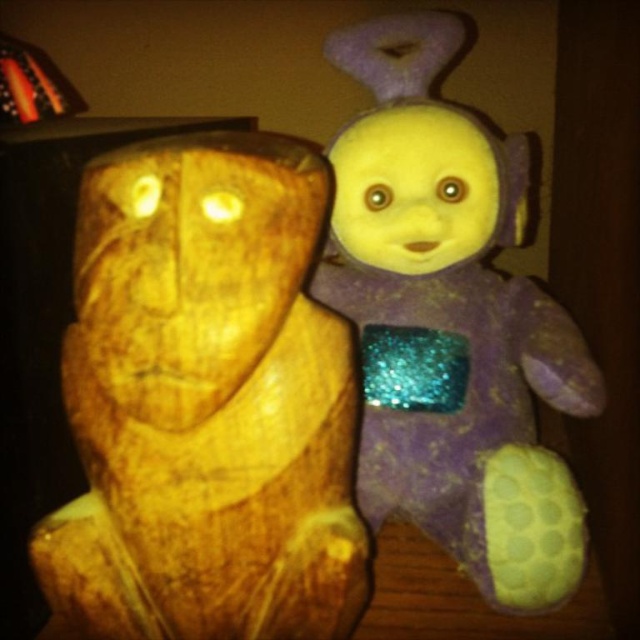
You are an art collector who wants to place a 10 inch wide decorative item between the wooden carving at left and the purple glittery plush at upper right. Based on the spacing between them, will there be enough room for the item?

The wooden carving at left is 8.08 inches from the purple glittery plush at upper right. Since the decorative item is 10 inches wide, which is wider than the available space between them, it will not fit.

You are an interior designer arranging a shelf. You have the wooden carving at left and the purple glittery plush at upper right. If you want to place them so that one is closer to the viewer, which object should you position forward?

You should position the wooden carving at left forward since it is already in front of the purple glittery plush at upper right, making it closer to the viewer.

You are holding a measuring tool that can only measure distances up to 20 inches. You need to determine the distance from the camera to the point labeled point (346, 506). Will your tool be able to measure this distance?

The distance of point (346, 506) from the camera is 23.21 inches, which exceeds the measuring tool limit of 20 inches. Therefore, the tool cannot measure this distance.